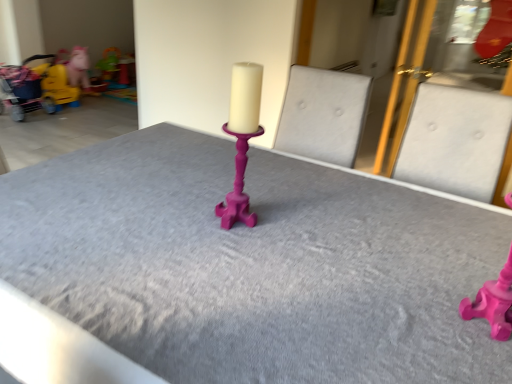
Where is `vacant location behind matte pink candlestick at center, marked as the 3th toy in a left-to-right arrangement`? The image size is (512, 384). vacant location behind matte pink candlestick at center, marked as the 3th toy in a left-to-right arrangement is located at coordinates (444, 268).